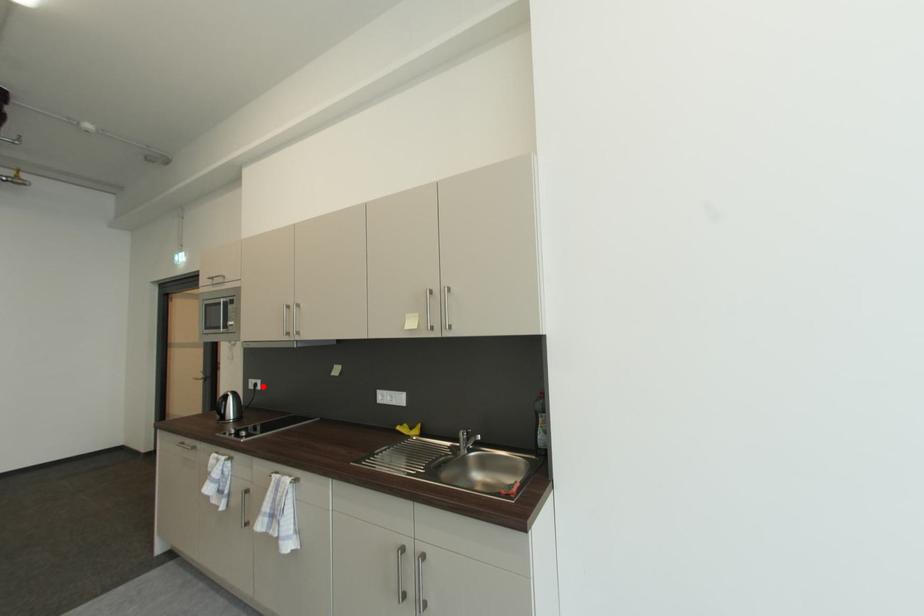
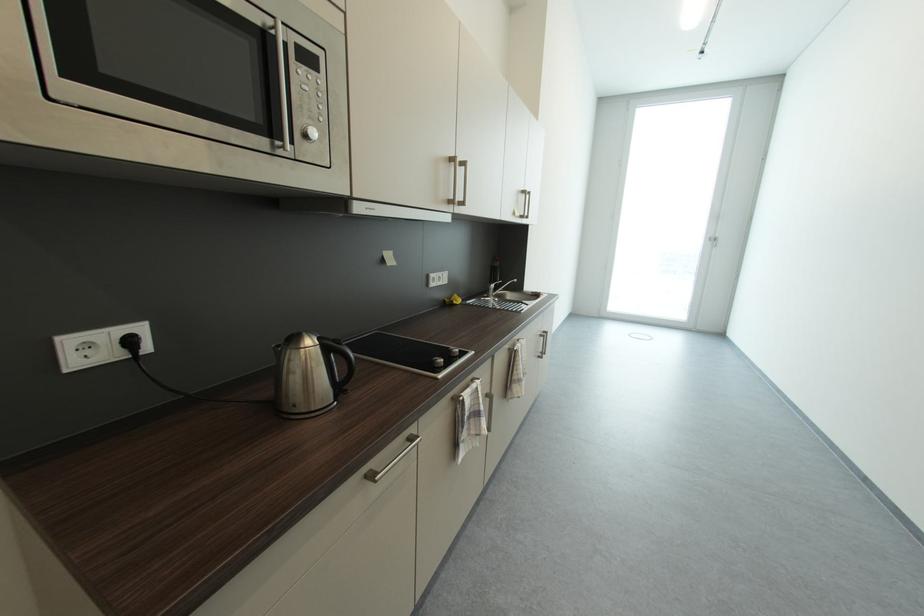
Find the pixel in the second image that matches the highlighted location in the first image.

(137, 344)